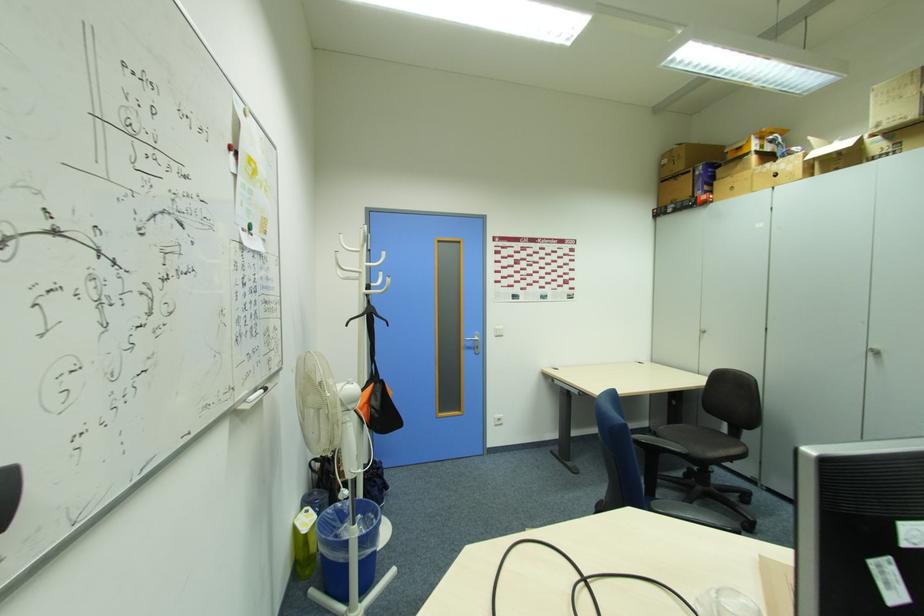
Describe the element at coordinates (475, 342) in the screenshot. I see `a silver door handle` at that location.